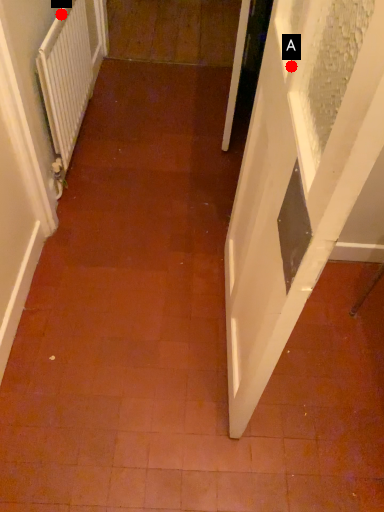
Question: Two points are circled on the image, labeled by A and B beside each circle. Which of the following is the closest to the observer?

Choices:
 (A) A is closer
 (B) B is closer

Answer: (A)